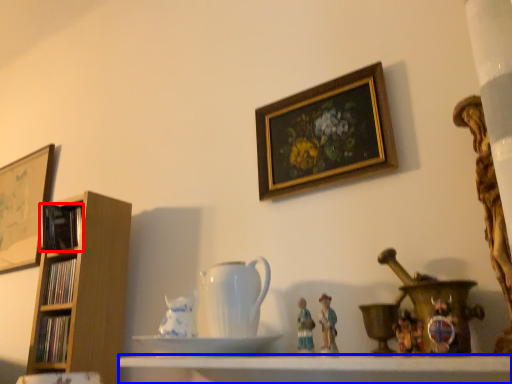
Question: Which object is closer to the camera taking this photo, book (highlighted by a red box) or shelf (highlighted by a blue box)?

Choices:
 (A) book
 (B) shelf

Answer: (B)